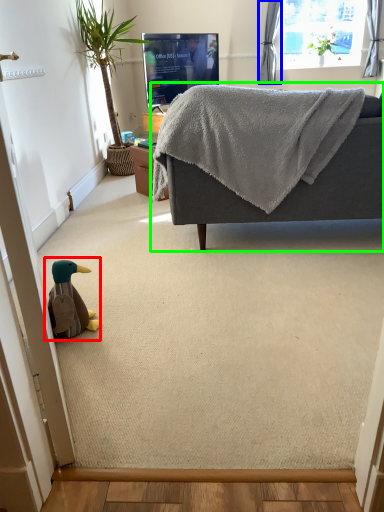
Question: Which is farther away from toy (highlighted by a red box)? curtain (highlighted by a blue box) or studio couch (highlighted by a green box)?

Choices:
 (A) curtain
 (B) studio couch

Answer: (A)